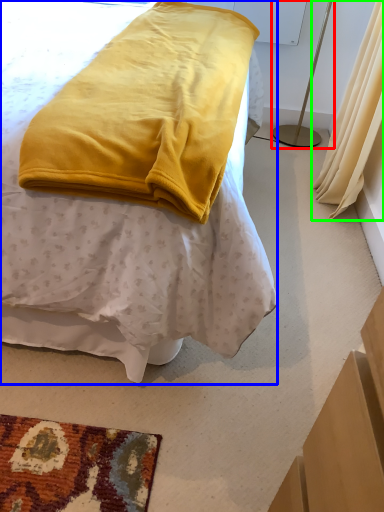
Question: Which object is the farthest from bedside lamp (highlighted by a red box)? Choose among these: bed (highlighted by a blue box) or curtain (highlighted by a green box).

Choices:
 (A) bed
 (B) curtain

Answer: (A)